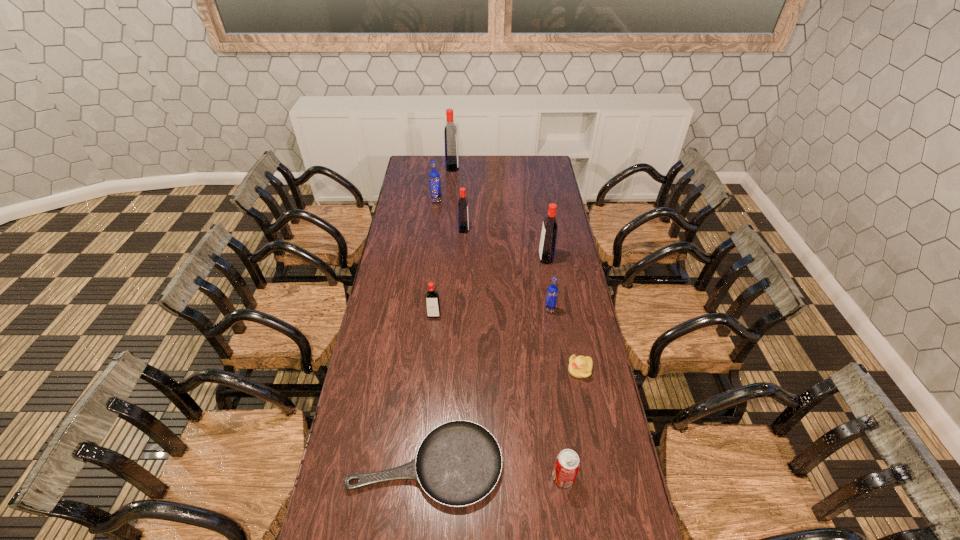
Where is `the smallest red vodka`? the smallest red vodka is located at coordinates click(433, 310).

Locate an element on the screen. The height and width of the screenshot is (540, 960). red soda can is located at coordinates point(567,464).

Find the location of `soda can`. soda can is located at coordinates (567, 464).

Find the location of a particular element. duckling is located at coordinates (579, 367).

Where is `the seventh farthest object`? the seventh farthest object is located at coordinates (579, 367).

This screenshot has width=960, height=540. I want to click on the shortest object, so click(458, 463).

I want to click on blank space located 0.100m on the front and back of the farthest red vodka, so click(x=475, y=168).

Where is `free space located on the front and back of the second nearest red vodka`? The image size is (960, 540). free space located on the front and back of the second nearest red vodka is located at coordinates (482, 258).

You are a GUI agent. You are given a task and a screenshot of the screen. Output one action in this format:
    pyautogui.click(x=<x>, y=<y>)
    Task: Click on the vacant area situated 0.270m on the front and back of the second nearest red vodka
    The height and width of the screenshot is (540, 960).
    Given the screenshot: What is the action you would take?
    pyautogui.click(x=482, y=258)

Where is `free location located 0.120m on the front and back of the second nearest red vodka`? free location located 0.120m on the front and back of the second nearest red vodka is located at coordinates (514, 258).